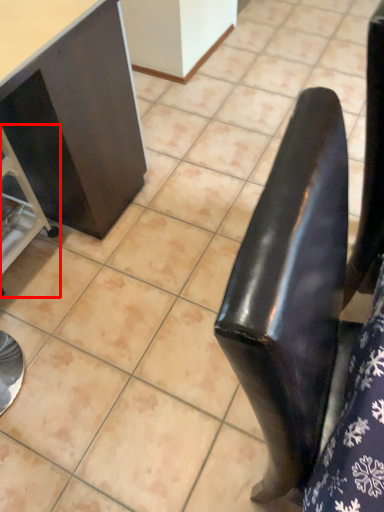
Question: From the image's perspective, what is the correct spatial positioning of furniture (annotated by the red box) in reference to furniture?

Choices:
 (A) below
 (B) above

Answer: (A)